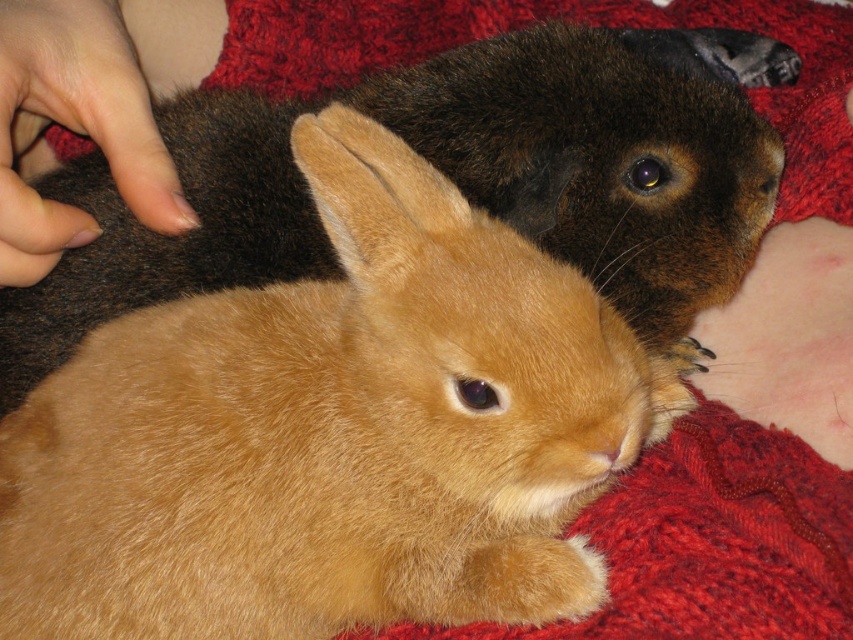
Question: Estimate the real-world distances between objects in this image. Which object is farther from the nail polish at upper left?

Choices:
 (A) soft brown fur rabbit at center
 (B) golden fur rabbit at center

Answer: (A)

Question: Is golden fur rabbit at center to the right of nail polish at upper left from the viewer's perspective?

Choices:
 (A) yes
 (B) no

Answer: (A)

Question: Which point is closer to the camera?

Choices:
 (A) golden fur rabbit at center
 (B) soft brown fur rabbit at center
 (C) nail polish at upper left

Answer: (B)

Question: Can you confirm if golden fur rabbit at center is wider than nail polish at upper left?

Choices:
 (A) no
 (B) yes

Answer: (B)

Question: Which object appears closest to the camera in this image?

Choices:
 (A) golden fur rabbit at center
 (B) nail polish at upper left

Answer: (B)

Question: Is golden fur rabbit at center further to camera compared to nail polish at upper left?

Choices:
 (A) no
 (B) yes

Answer: (B)